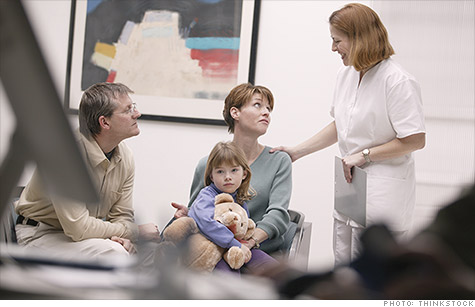
Where is `painting`? Image resolution: width=475 pixels, height=307 pixels. painting is located at coordinates (219, 35).